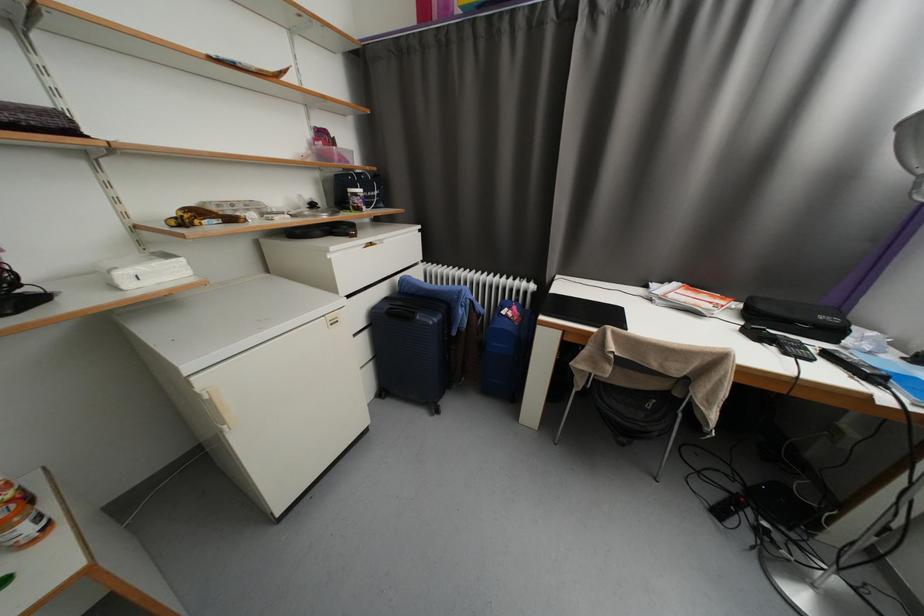
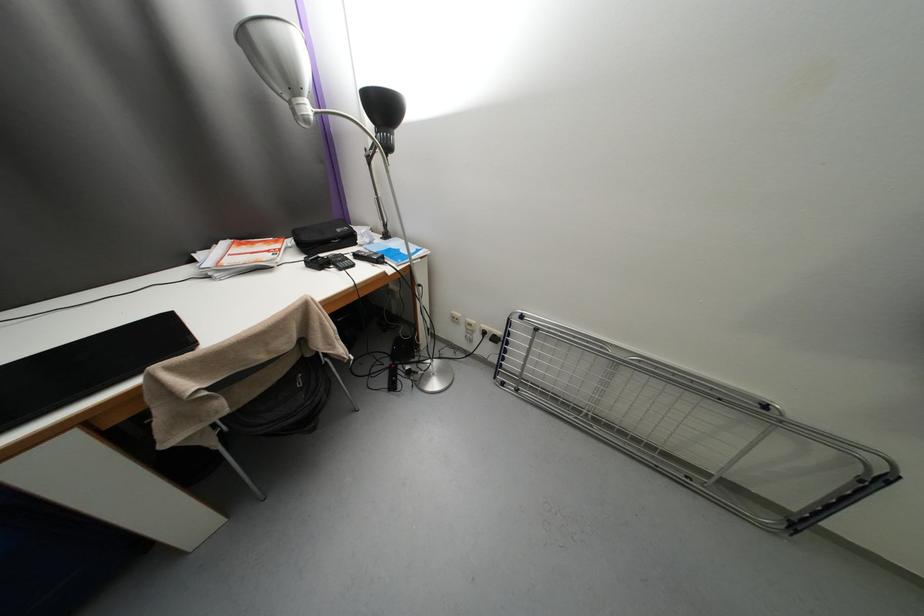
First-person continuous shooting, in which direction is the camera rotating?

The camera's rotation is toward right-down.